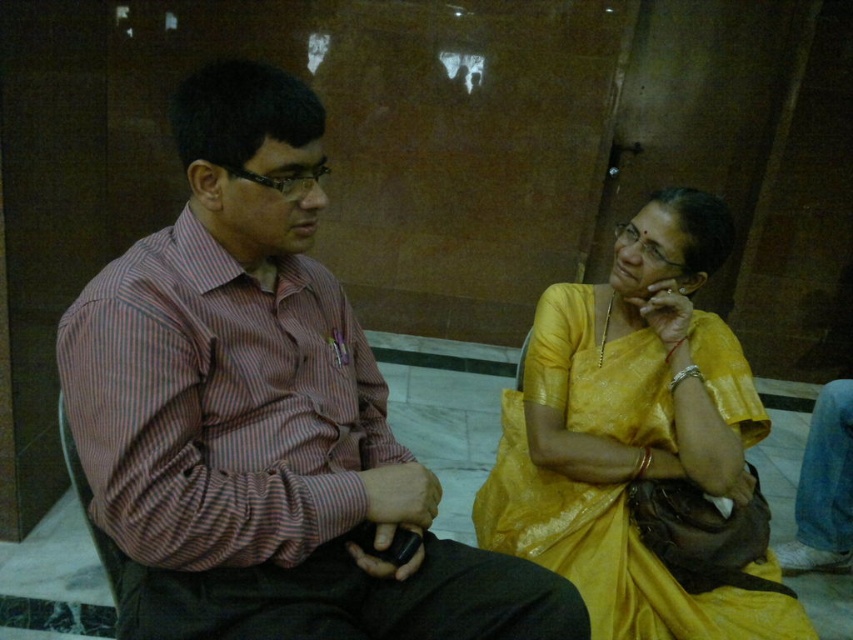
Can you confirm if striped cotton shirt at left is bigger than matte yellow saree at right?

No, striped cotton shirt at left is not bigger than matte yellow saree at right.

Locate an element on the screen. striped cotton shirt at left is located at coordinates point(263,413).

What do you see at coordinates (263, 413) in the screenshot? The height and width of the screenshot is (640, 853). I see `striped cotton shirt at left` at bounding box center [263, 413].

At what (x,y) coordinates should I click in order to perform the action: click on striped cotton shirt at left. Please return your answer as a coordinate pair (x, y). Looking at the image, I should click on (x=263, y=413).